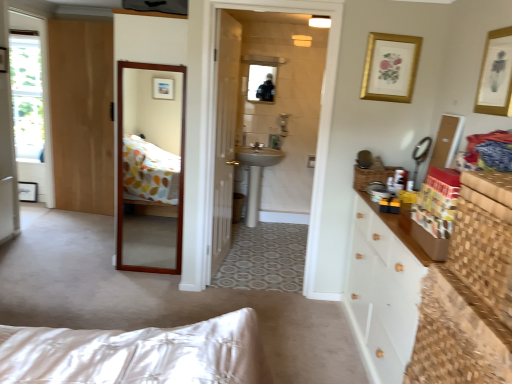
Where is `free spot above wooden drawer at center-right (from a real-world perspective)`? free spot above wooden drawer at center-right (from a real-world perspective) is located at coordinates pos(377,170).